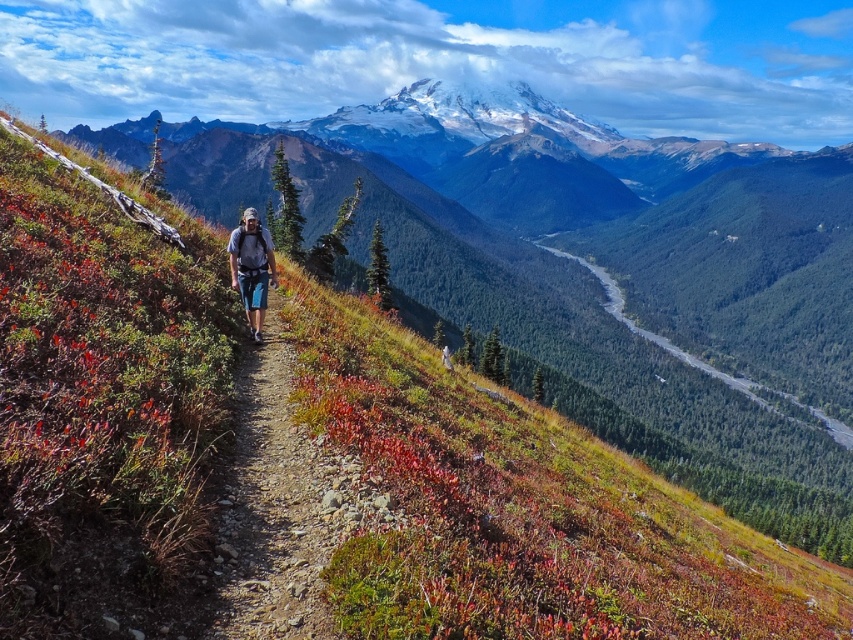
You are a hiker trying to follow the dirt path at center while avoiding stepping on the matte blue jeans at center. Which object should you focus on walking on and which should you avoid?

You should focus on walking on the dirt path at center because it is larger in size than the matte blue jeans at center, so avoiding the smaller matte blue jeans at center.

You are standing at the point labeled point(247, 310) and want to reach the point labeled point(846, 432). Which direction should you move to get closer to your destination?

You should move forward because point(247, 310) is closer to the camera than point(846, 432), so moving forward along the path will bring you closer to the destination.